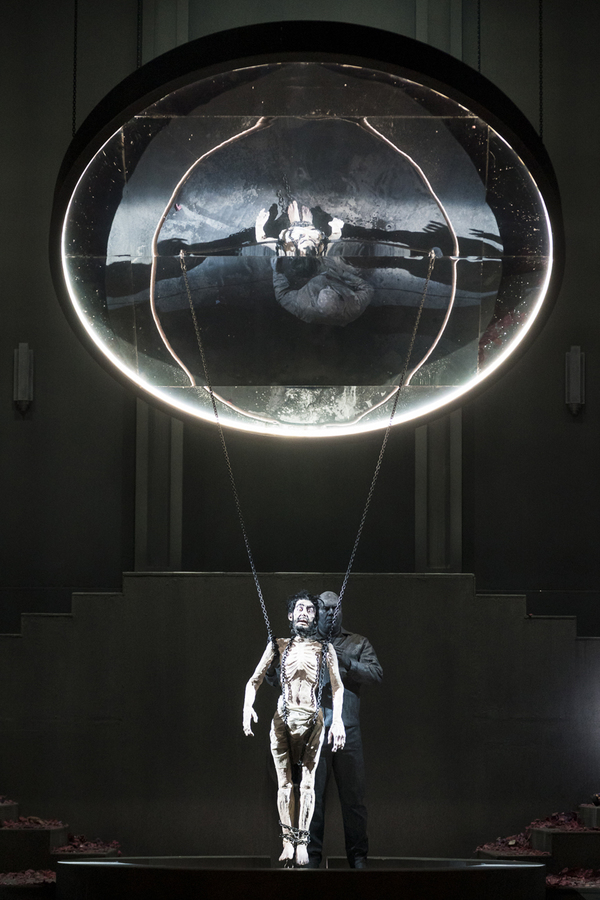
Locate an element on the screen. The width and height of the screenshot is (600, 900). white cloth covering is located at coordinates (298, 716).